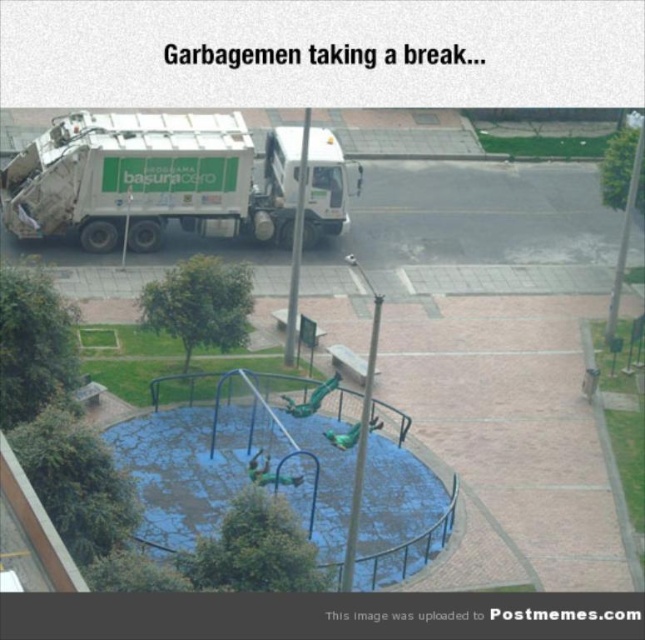
Based on the photo, you are standing at the center of the playground and want to reach the white glossy garbage truck at left. According to the coordinates provided, in which direction should you move to get there?

The white glossy garbage truck at left is located at point coordinates, so you should move to the left from the center of the playground to reach it.